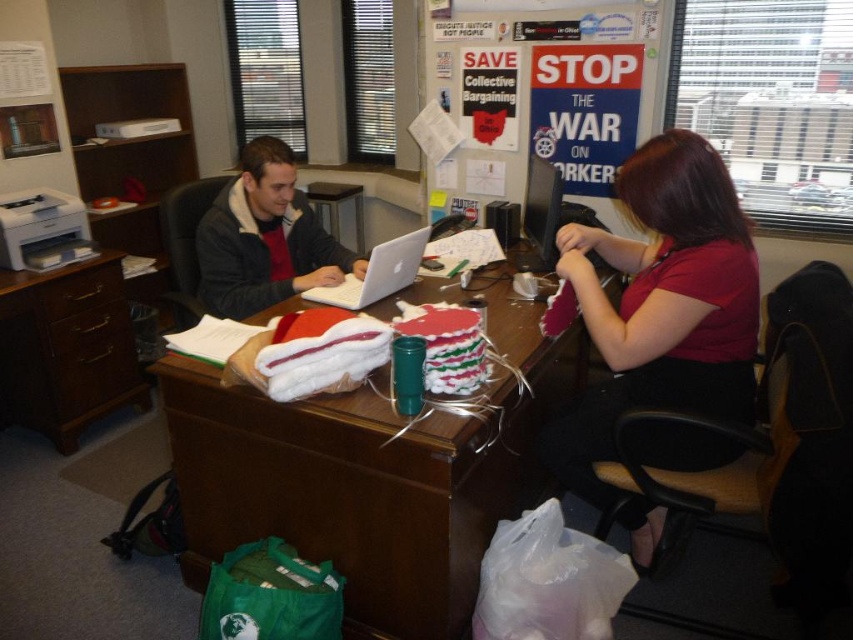
Question: Which point is closer to the camera?

Choices:
 (A) matte red shirt at center
 (B) wooden at center
 (C) dark gray jacket at center

Answer: (B)

Question: Is brown wood computer desk at left wider than silver metallic laptop at center?

Choices:
 (A) no
 (B) yes

Answer: (B)

Question: Can you confirm if wooden at center is positioned to the right of dark gray jacket at center?

Choices:
 (A) yes
 (B) no

Answer: (A)

Question: Among these objects, which one is farthest from the camera?

Choices:
 (A) brown wood computer desk at left
 (B) wooden at center

Answer: (A)

Question: Which point appears closest to the camera in this image?

Choices:
 (A) (743, 316)
 (B) (425, 300)

Answer: (A)

Question: Does matte red shirt at center appear on the right side of dark gray jacket at center?

Choices:
 (A) no
 (B) yes

Answer: (B)